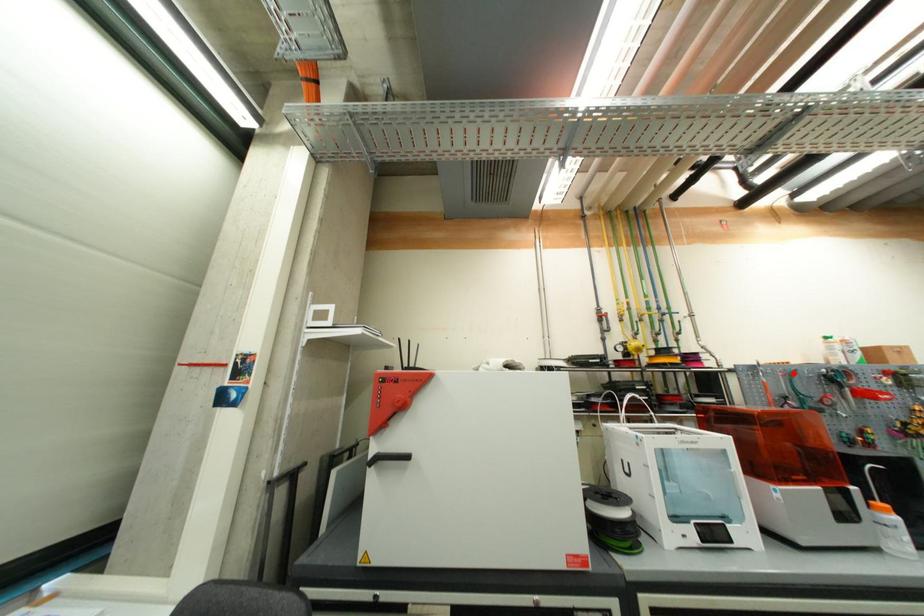
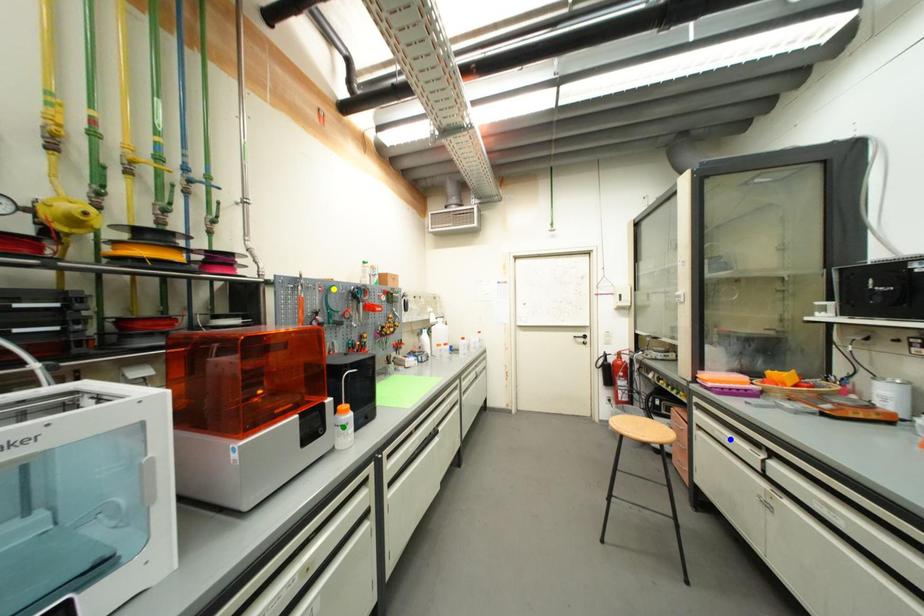
Question: I am providing you with two images of the same scene from different viewpoints. A red point is marked on the first image. You are given multiple points on the second image. Can you choose the point in image 2 that corresponds to the point in image 1?

Choices:
 (A) green point
 (B) blue point
 (C) yellow point

Answer: (C)